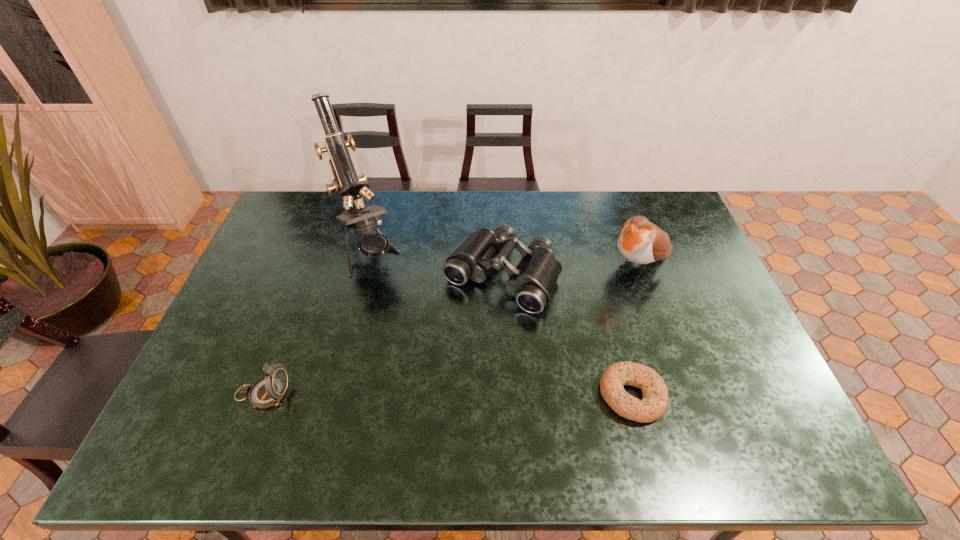
This screenshot has width=960, height=540. Find the location of `compass`. compass is located at coordinates (268, 391).

Where is `bagel`? This screenshot has width=960, height=540. bagel is located at coordinates (653, 405).

The height and width of the screenshot is (540, 960). What are the coordinates of `bird` in the screenshot? It's located at (640, 241).

Image resolution: width=960 pixels, height=540 pixels. What are the coordinates of `the tallest object` in the screenshot? It's located at (349, 185).

Image resolution: width=960 pixels, height=540 pixels. I want to click on the third object from right to left, so click(532, 282).

This screenshot has width=960, height=540. I want to click on vacant space positioned on the face of the compass, so click(378, 394).

Find the location of `blank space located on the back of the bagel`. blank space located on the back of the bagel is located at coordinates (600, 275).

Where is `vacant area situated at the face of the second tallest object`? vacant area situated at the face of the second tallest object is located at coordinates (545, 328).

You are a GUI agent. You are given a task and a screenshot of the screen. Output one action in this format:
    pyautogui.click(x=<x>, y=<y>)
    Task: Click on the vacant area situated at the face of the second tallest object
    The image size is (960, 540).
    Given the screenshot: What is the action you would take?
    pyautogui.click(x=563, y=316)

At what (x,y) coordinates should I click in order to perform the action: click on free space located 0.280m at the face of the second tallest object. Please return your answer as a coordinate pair (x, y). Looking at the image, I should click on (553, 323).